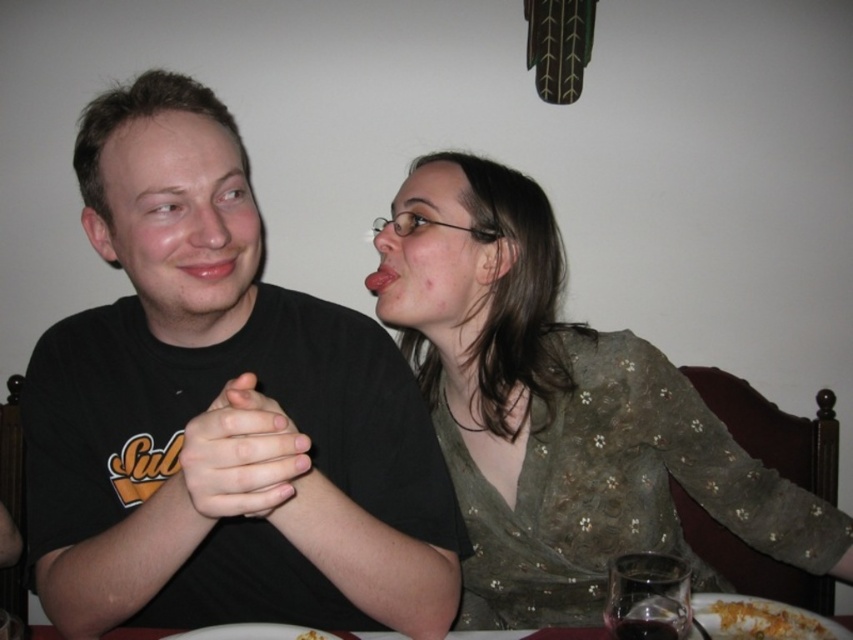
You are standing at the center of the table and want to place a small gift for the person at point (511, 216). However, there is an obstacle at point (386, 456). Which direction should you move to avoid the obstacle and reach the desired location?

To reach the person at point (511, 216) while avoiding the obstacle at point (386, 456), you should move towards the upper left direction since point (386, 456) is in front of point (511, 216).

You are a food critic who wants to compare the two dishes in the image. Which of the two dishes, the yellowish crumbly food at lower right or the yellowish matte pasta at lower center, is taller?

The yellowish crumbly food at lower right is taller than the yellowish matte pasta at lower center.

You are a photographer trying to capture a candid shot of the two people at the table. You want to ensure that both the black matte shirt at center and the green textured blouse at center are clearly visible in the frame. Based on their heights, which clothing item might you need to adjust your camera angle to better include in the shot?

The black matte shirt at center is not as tall as the green textured blouse at center, so you might need to lower your camera angle slightly to ensure the black matte shirt at center is fully visible in the frame.